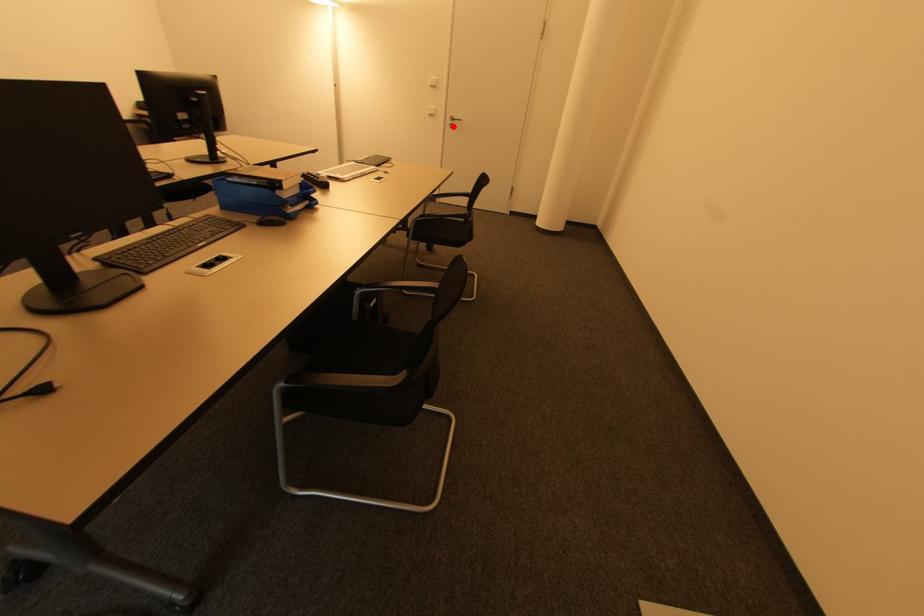
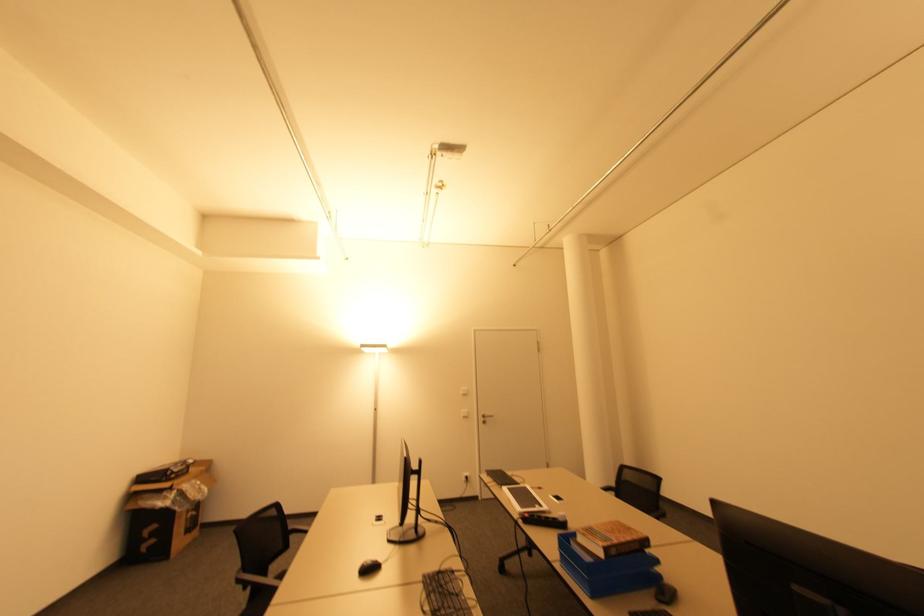
Question: A red point is marked in image1. In image2, is the corresponding 3D point closer to the camera or farther? Reply with the corresponding letter.

Choices:
 (A) The corresponding 3D point is closer.
 (B) The corresponding 3D point is farther.

Answer: (B)